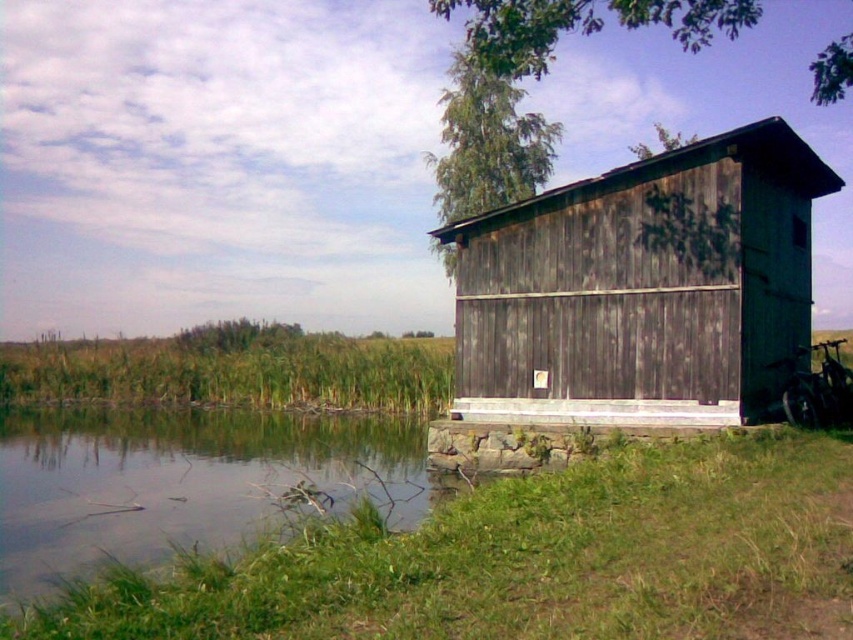
Question: Does weathered wood hut at right have a larger size compared to clear water at lower left?

Choices:
 (A) no
 (B) yes

Answer: (A)

Question: Does weathered wood hut at right appear under clear water at lower left?

Choices:
 (A) no
 (B) yes

Answer: (A)

Question: Can you confirm if weathered wood hut at right is thinner than clear water at lower left?

Choices:
 (A) no
 (B) yes

Answer: (B)

Question: Among these objects, which one is farthest from the camera?

Choices:
 (A) clear water at lower left
 (B) weathered wood hut at right

Answer: (B)